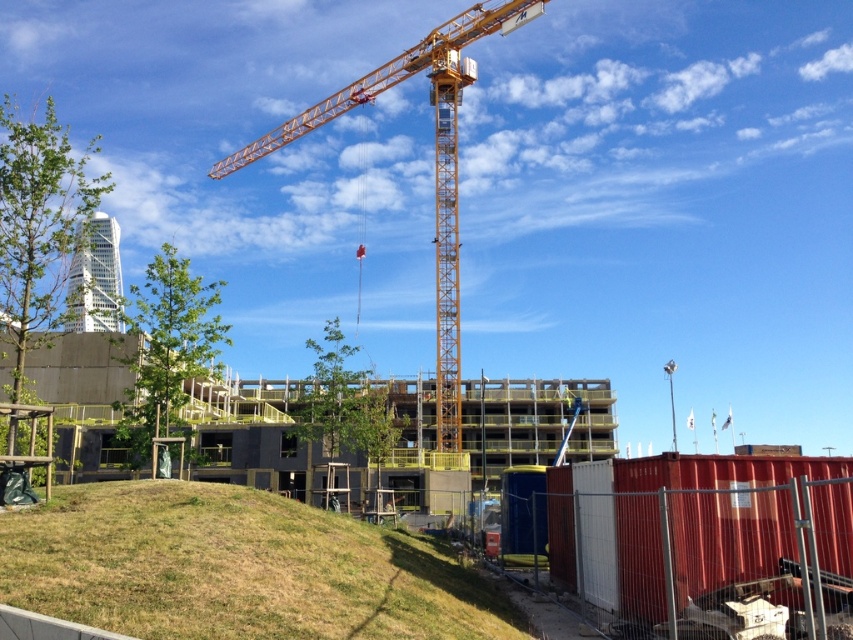
Question: Is green grassy hill at lower left bigger than yellow metallic crane at center?

Choices:
 (A) yes
 (B) no

Answer: (B)

Question: Which point is closer to the camera?

Choices:
 (A) (155, 564)
 (B) (229, 156)

Answer: (A)

Question: Considering the relative positions of green grassy hill at lower left and yellow metallic crane at center in the image provided, where is green grassy hill at lower left located with respect to yellow metallic crane at center?

Choices:
 (A) left
 (B) right

Answer: (B)

Question: Does green grassy hill at lower left appear under yellow metallic crane at center?

Choices:
 (A) no
 (B) yes

Answer: (B)

Question: Among these points, which one is farthest from the camera?

Choices:
 (A) (183, 531)
 (B) (258, 150)

Answer: (B)